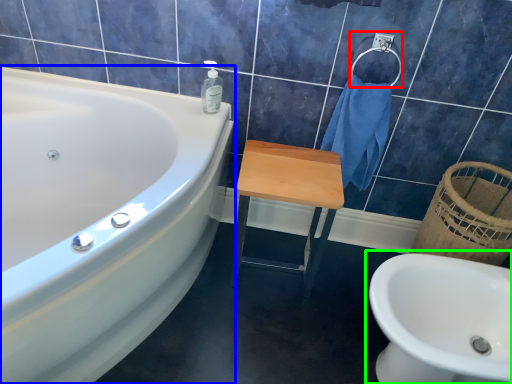
Question: Which is nearer to the towel bar (highlighted by a red box)? bathtub (highlighted by a blue box) or sink (highlighted by a green box).

Choices:
 (A) bathtub
 (B) sink

Answer: (B)